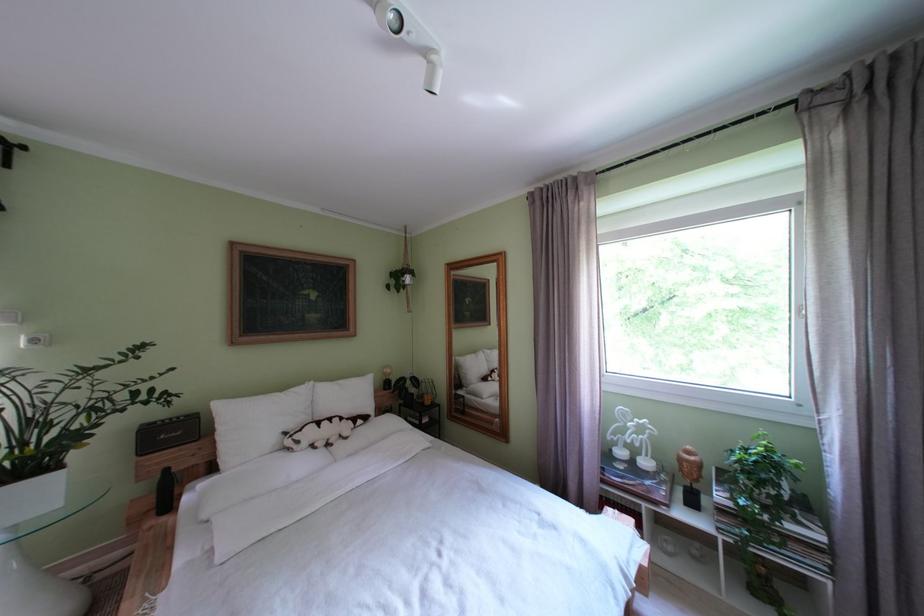
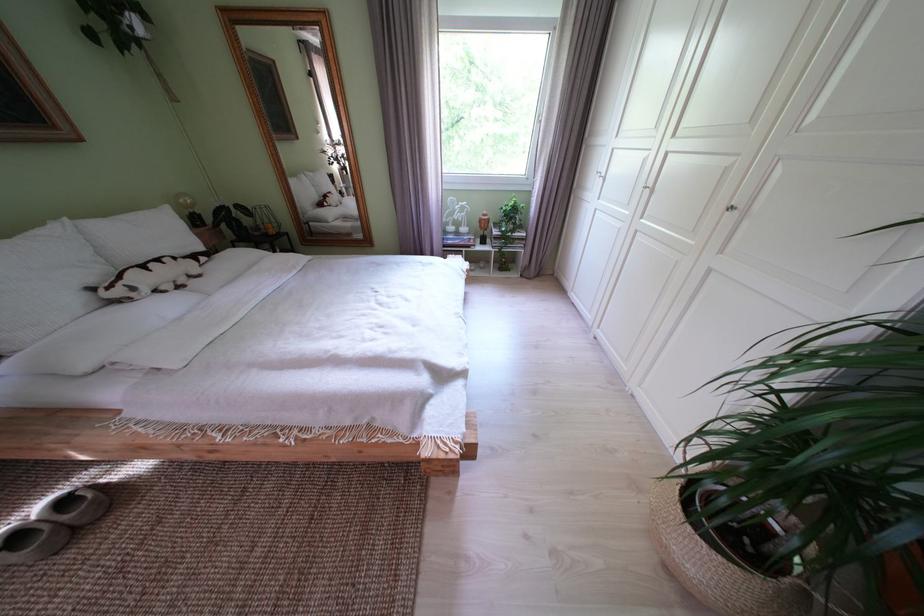
Where in the second image is the point corresponding to pixel 310 447 from the first image?

(146, 294)